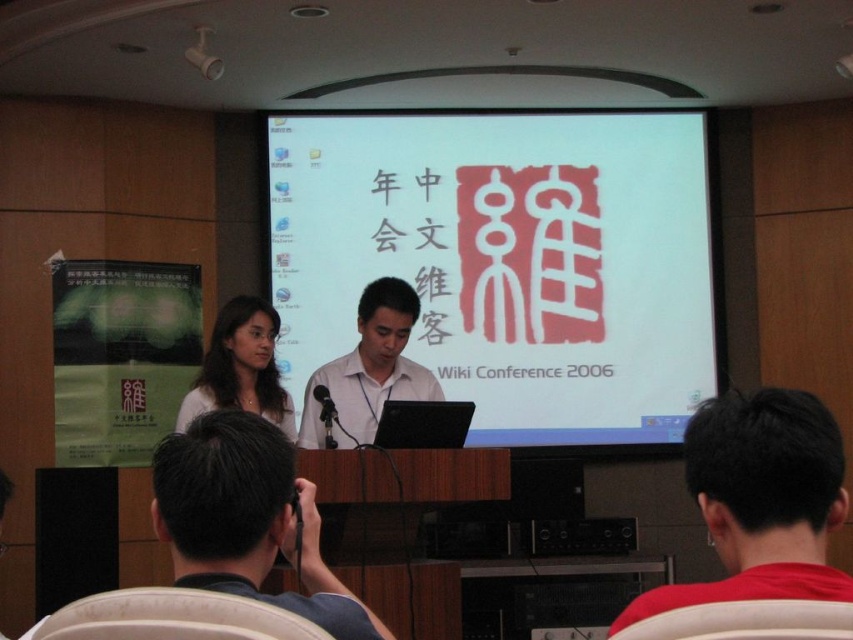
Question: Does white matte shirt at center appear over smooth brown hair at center?

Choices:
 (A) no
 (B) yes

Answer: (A)

Question: Is black fabric camera at lower center to the left of smooth brown hair at center from the viewer's perspective?

Choices:
 (A) no
 (B) yes

Answer: (A)

Question: Which of the following is the farthest from the observer?

Choices:
 (A) (709, 349)
 (B) (218, 369)

Answer: (A)

Question: Which object is closer to the camera taking this photo?

Choices:
 (A) black fabric camera at lower center
 (B) white paper at center
 (C) black plastic microphone at center
 (D) smooth brown hair at center

Answer: (A)

Question: Where is white paper at center located in relation to black plastic microphone at center in the image?

Choices:
 (A) right
 (B) left

Answer: (A)

Question: Which of the following is the farthest from the observer?

Choices:
 (A) coord(361,353)
 (B) coord(488,232)

Answer: (B)